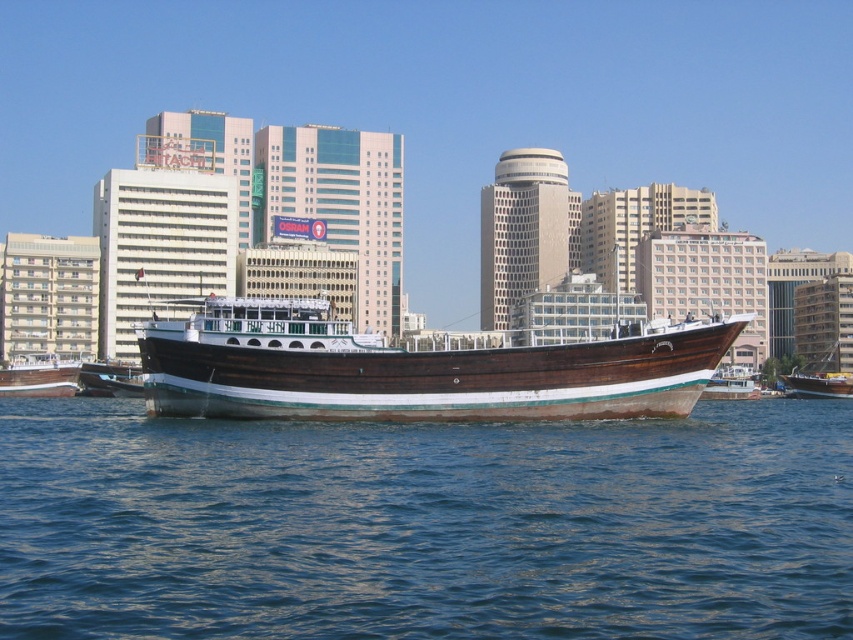
Question: Considering the real-world distances, which object is closest to the blue water at center?

Choices:
 (A) wooden boat at left
 (B) wooden polished boat at center
 (C) brown polished wood boat at center

Answer: (C)

Question: Among these objects, which one is nearest to the camera?

Choices:
 (A) brown polished wood boat at center
 (B) wooden boat at center

Answer: (A)

Question: Which object is closer to the camera taking this photo?

Choices:
 (A) wooden boat at center
 (B) blue water at center
 (C) brown polished wood boat at center

Answer: (B)

Question: Can you confirm if wooden boat at left is positioned to the left of wooden polished boat at center?

Choices:
 (A) no
 (B) yes

Answer: (B)

Question: Observing the image, what is the correct spatial positioning of wooden boat at left in reference to wooden boat at center?

Choices:
 (A) right
 (B) left

Answer: (B)

Question: In this image, where is wooden boat at left located relative to wooden boat at center?

Choices:
 (A) above
 (B) below

Answer: (A)